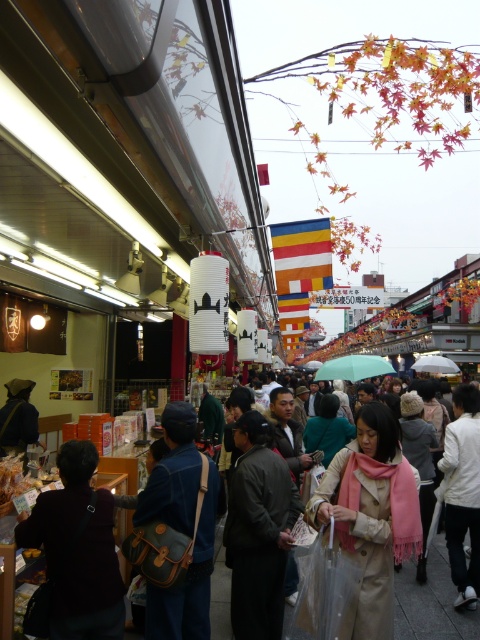
Question: Which point appears closest to the camera in this image?

Choices:
 (A) (23, 380)
 (B) (181, 637)

Answer: (B)

Question: Is dark brown leather bag at lower left below denim jacket at center?

Choices:
 (A) yes
 (B) no

Answer: (A)

Question: Considering the real-world distances, which object is farthest from the denim jacket at center?

Choices:
 (A) dark brown leather jacket at lower left
 (B) beige wool coat at center
 (C) dark brown leather bag at lower left
 (D) white matte jacket at lower right

Answer: (A)

Question: Estimate the real-world distances between objects in this image. Which object is closer to the white matte jacket at lower right?

Choices:
 (A) dark brown leather jacket at lower left
 (B) denim jacket at center

Answer: (B)

Question: Is beige wool coat at center to the right of dark brown leather jacket at lower left from the viewer's perspective?

Choices:
 (A) no
 (B) yes

Answer: (B)

Question: Is denim jacket at center thinner than dark brown leather jacket at lower left?

Choices:
 (A) no
 (B) yes

Answer: (B)